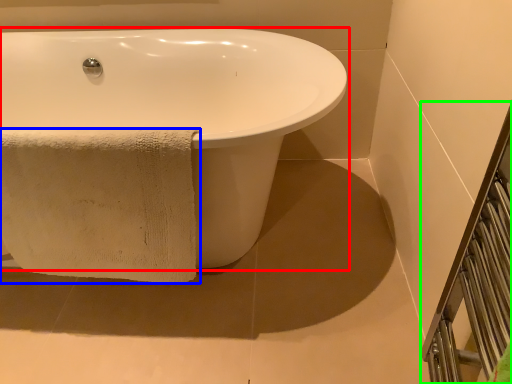
Question: Which object is positioned closest to bathtub (highlighted by a red box)? Select from towel (highlighted by a blue box) and balustrade (highlighted by a green box).

Choices:
 (A) towel
 (B) balustrade

Answer: (A)